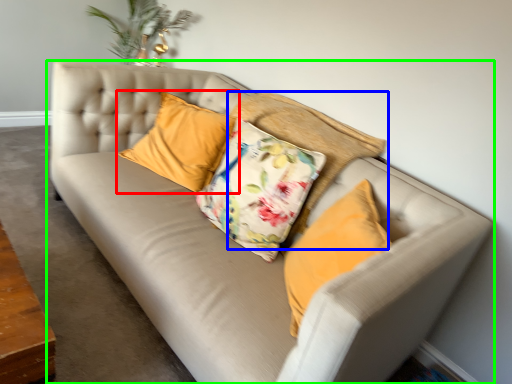
Question: Estimate the real-world distances between objects in this image. Which object is closer to pillow (highlighted by a red box), pillow (highlighted by a blue box) or studio couch (highlighted by a green box)?

Choices:
 (A) pillow
 (B) studio couch

Answer: (A)